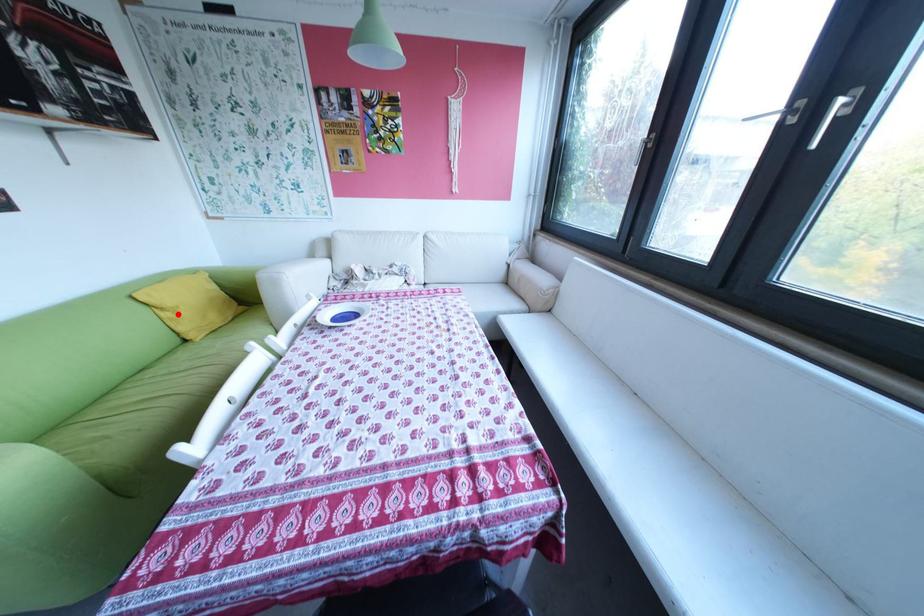
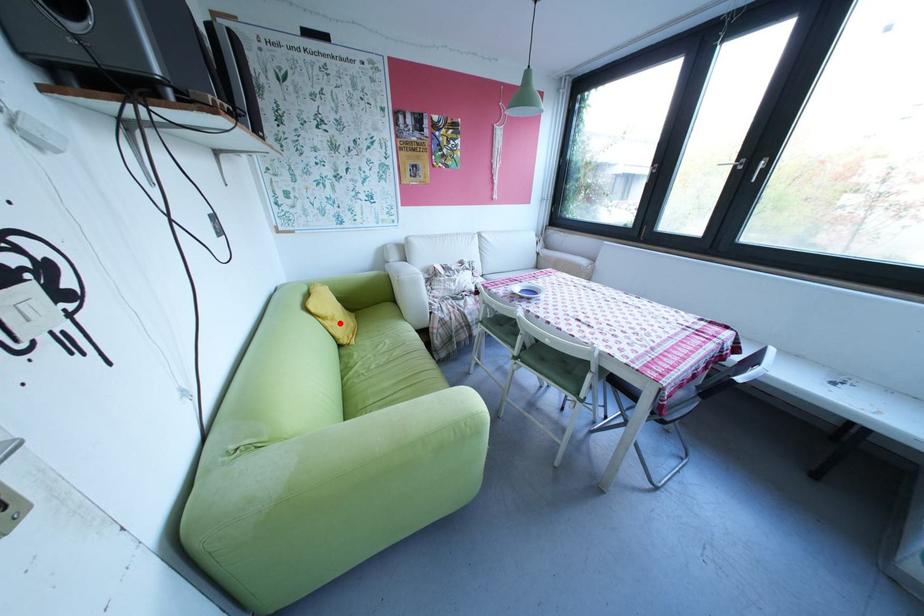
I am providing you with two images of the same scene from different viewpoints. A red point is marked on the first image and another point is marked on the second image. Are the points marked in image1 and image2 representing the same 3D position?

Yes